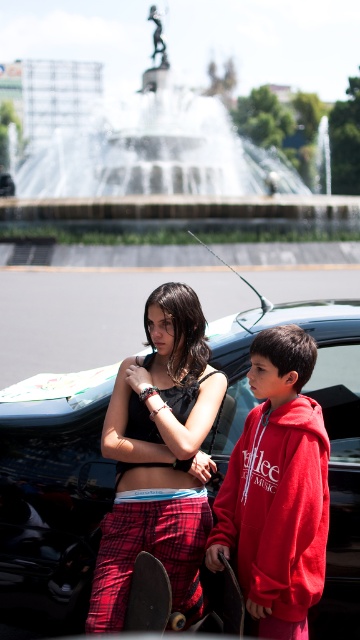
Can you confirm if white marble fountain at center is smaller than black smooth skateboard at lower center?

Actually, white marble fountain at center might be larger than black smooth skateboard at lower center.

Which is more to the right, white marble fountain at center or black smooth skateboard at lower center?

Positioned to the right is white marble fountain at center.

Is point (168, 22) positioned before point (234, 612)?

No, it is not.

Identify the location of white marble fountain at center. The image size is (360, 640). (191, 44).

Is shiny black car at center bigger than black smooth skateboard at lower center?

Yes.

Is shiny black car at center taller than black smooth skateboard at lower center?

Yes.

Does point (56, 419) come in front of point (239, 630)?

That is False.

This screenshot has width=360, height=640. What are the coordinates of `shiny black car at center` in the screenshot? It's located at (51, 504).

Is shiny black car at center to the right of black matte skateboard at lower left from the viewer's perspective?

Correct, you'll find shiny black car at center to the right of black matte skateboard at lower left.

Between shiny black car at center and black matte skateboard at lower left, which one appears on the right side from the viewer's perspective?

Positioned to the right is shiny black car at center.

Is point (38, 602) behind point (147, 620)?

That is True.

Find the location of a particular element. The height and width of the screenshot is (640, 360). shiny black car at center is located at coordinates (51, 504).